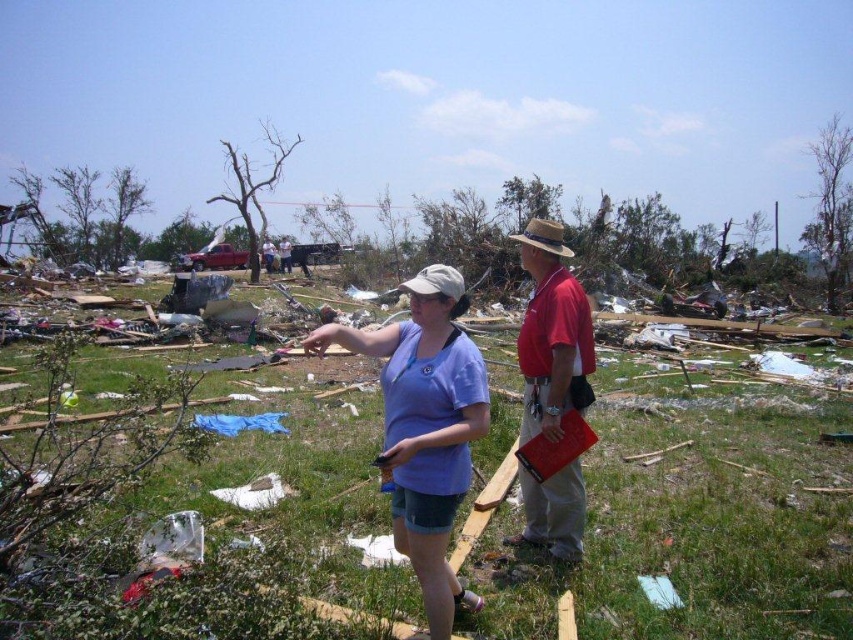
Question: Is red cotton shirt at center to the right of matte blue shirt at center from the viewer's perspective?

Choices:
 (A) yes
 (B) no

Answer: (A)

Question: Can you confirm if purple cotton shirt at center is smaller than matte blue shirt at center?

Choices:
 (A) no
 (B) yes

Answer: (A)

Question: Is purple cotton shirt at center below matte blue shirt at center?

Choices:
 (A) no
 (B) yes

Answer: (B)

Question: Estimate the real-world distances between objects in this image. Which object is farther from the matte blue shirt at center?

Choices:
 (A) red cotton shirt at center
 (B) purple cotton shirt at center

Answer: (B)

Question: Among these objects, which one is nearest to the camera?

Choices:
 (A) purple cotton shirt at center
 (B) red cotton shirt at center

Answer: (A)

Question: Among these objects, which one is farthest from the camera?

Choices:
 (A) purple cotton shirt at center
 (B) red cotton shirt at center
 (C) matte blue shirt at center

Answer: (C)